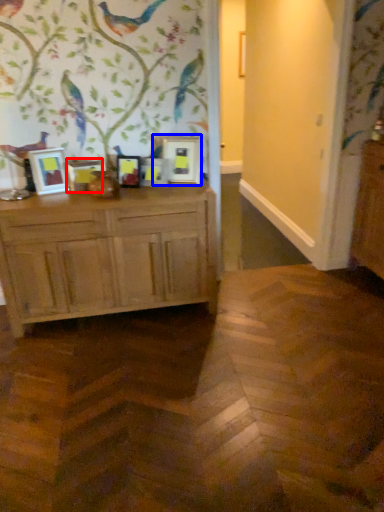
Question: Which object appears closest to the camera in this image, picture frame (highlighted by a red box) or picture frame (highlighted by a blue box)?

Choices:
 (A) picture frame
 (B) picture frame

Answer: (A)